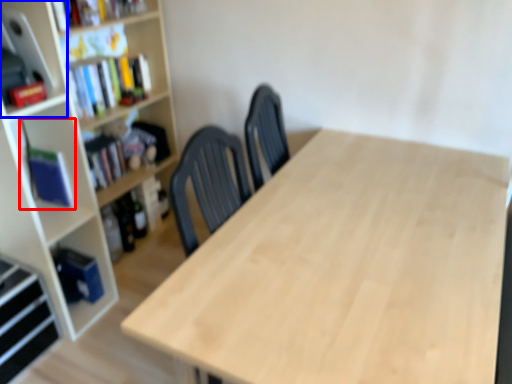
Question: Which object is further to the camera taking this photo, book (highlighted by a red box) or cabinet (highlighted by a blue box)?

Choices:
 (A) book
 (B) cabinet

Answer: (A)